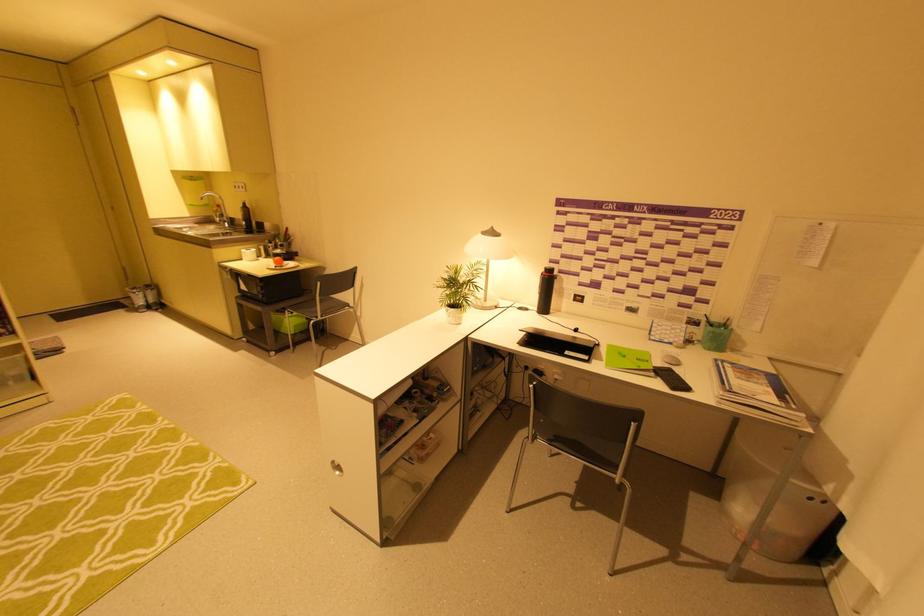
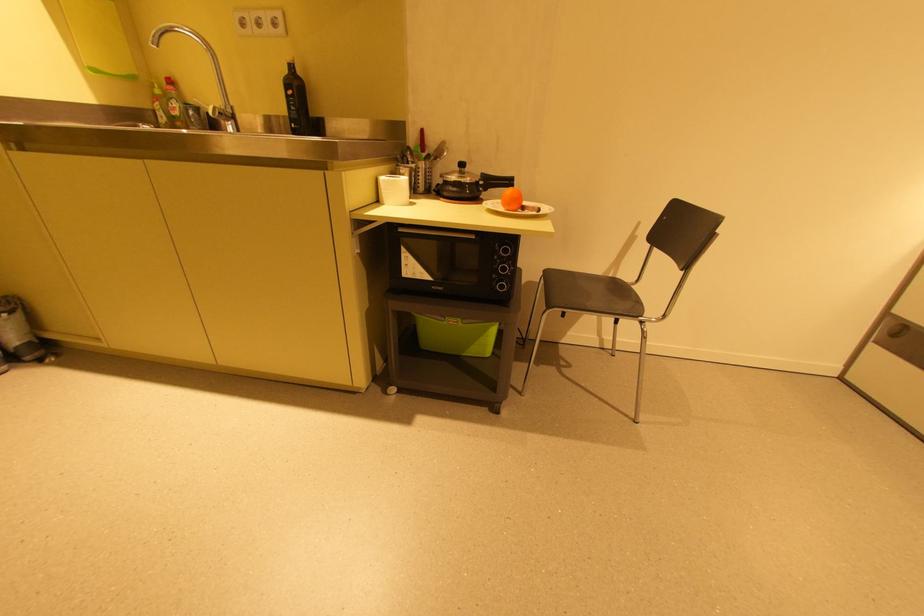
Which direction would the cameraman need to move to produce the second image?

The movement direction of the cameraman is left, forward.